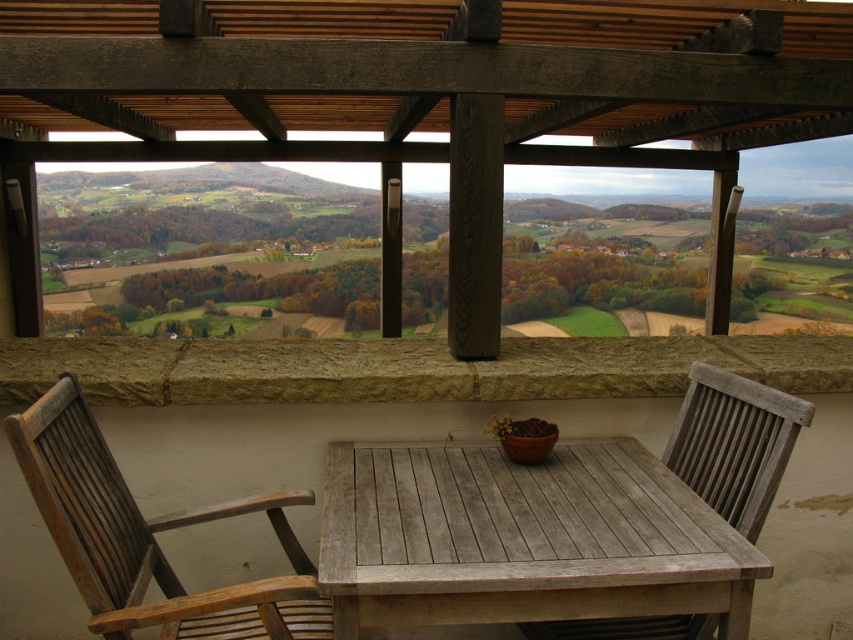
Can you confirm if weathered wood table at center is wider than wooden chair at lower left?

Yes, weathered wood table at center is wider than wooden chair at lower left.

Between weathered wood table at center and wooden chair at lower left, which one has more height?

wooden chair at lower left is taller.

This screenshot has height=640, width=853. What do you see at coordinates (523, 538) in the screenshot?
I see `weathered wood table at center` at bounding box center [523, 538].

The image size is (853, 640). I want to click on weathered wood table at center, so click(x=523, y=538).

Does weathered wood table at center appear under weathered wood chair at center?

Indeed, weathered wood table at center is positioned under weathered wood chair at center.

Does weathered wood table at center have a lesser width compared to weathered wood chair at center?

No, weathered wood table at center is not thinner than weathered wood chair at center.

Who is more distant from viewer, (428, 449) or (711, 493)?

The point (428, 449) is behind.

In order to click on weathered wood table at center in this screenshot , I will do `click(523, 538)`.

Does wooden chair at lower left appear under weathered wood chair at center?

Indeed, wooden chair at lower left is positioned under weathered wood chair at center.

Can you confirm if wooden chair at lower left is shorter than weathered wood chair at center?

Yes.

Between point (78, 452) and point (712, 372), which one is positioned in front?

Point (78, 452) is more forward.

Locate an element on the screen. This screenshot has height=640, width=853. wooden chair at lower left is located at coordinates (148, 538).